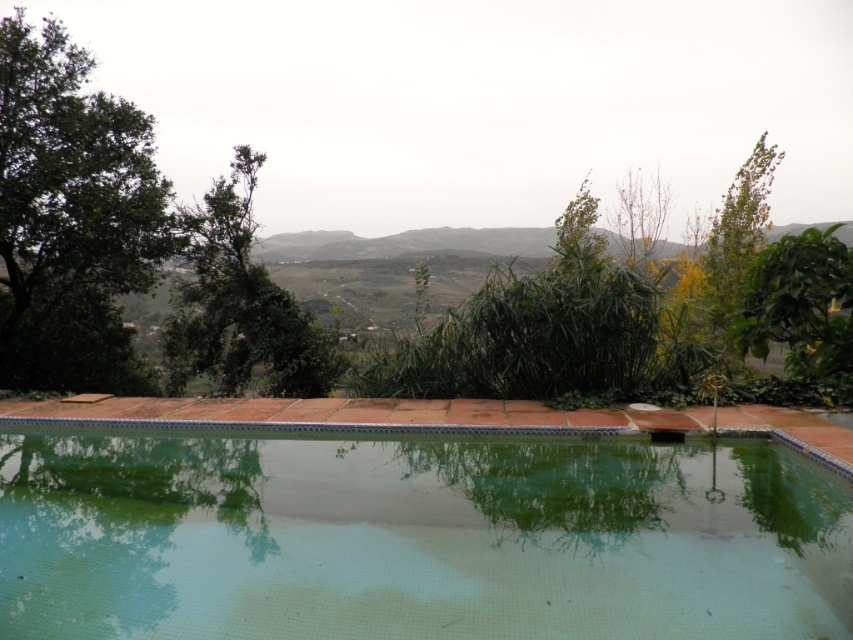
Based on the photo, which is more to the left, green leafy tree at upper left or yellow-green leafy tree at upper right?

From the viewer's perspective, green leafy tree at upper left appears more on the left side.

Between green leafy tree at upper left and yellow-green leafy tree at upper right, which one is positioned lower?

green leafy tree at upper left is lower down.

Between point (210, 252) and point (761, 157), which one is positioned in front?

Point (210, 252)

I want to click on green leafy tree at upper left, so click(241, 304).

Who is lower down, green leafy tree at left or green leafy tree at upper right?

green leafy tree at upper right is below.

Describe the element at coordinates (73, 218) in the screenshot. This screenshot has height=640, width=853. I see `green leafy tree at left` at that location.

Is point (16, 342) closer to viewer compared to point (842, 260)?

That is False.

Locate an element on the screen. green leafy tree at left is located at coordinates (73, 218).

Who is more distant from viewer, (4, 38) or (299, 388)?

The point (299, 388) is more distant.

Is green leafy tree at left wider than green leafy tree at upper left?

Incorrect, green leafy tree at left's width does not surpass green leafy tree at upper left's.

Between point (13, 200) and point (263, 288), which one is positioned in front?

Point (13, 200) is in front.

Where is `green leafy tree at left`? This screenshot has height=640, width=853. green leafy tree at left is located at coordinates (73, 218).